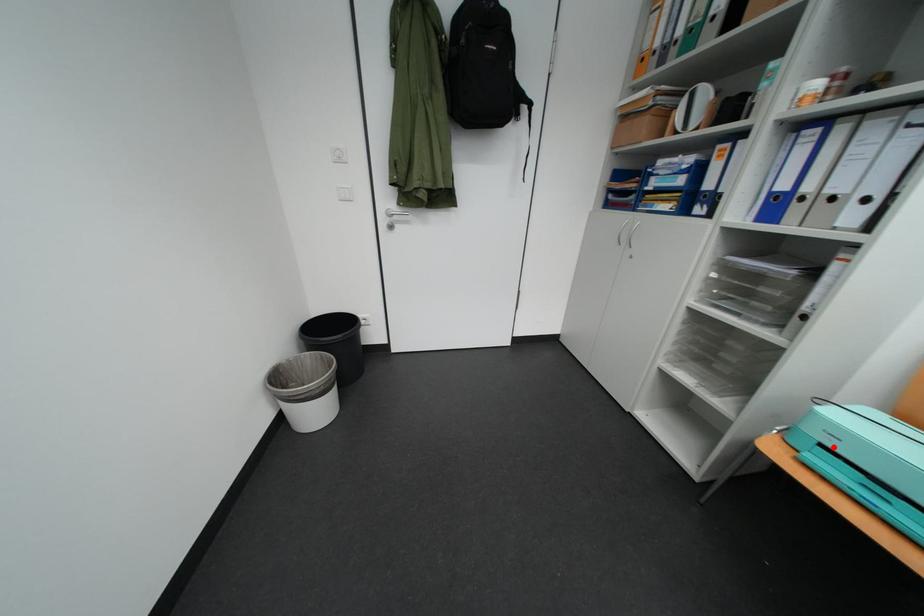
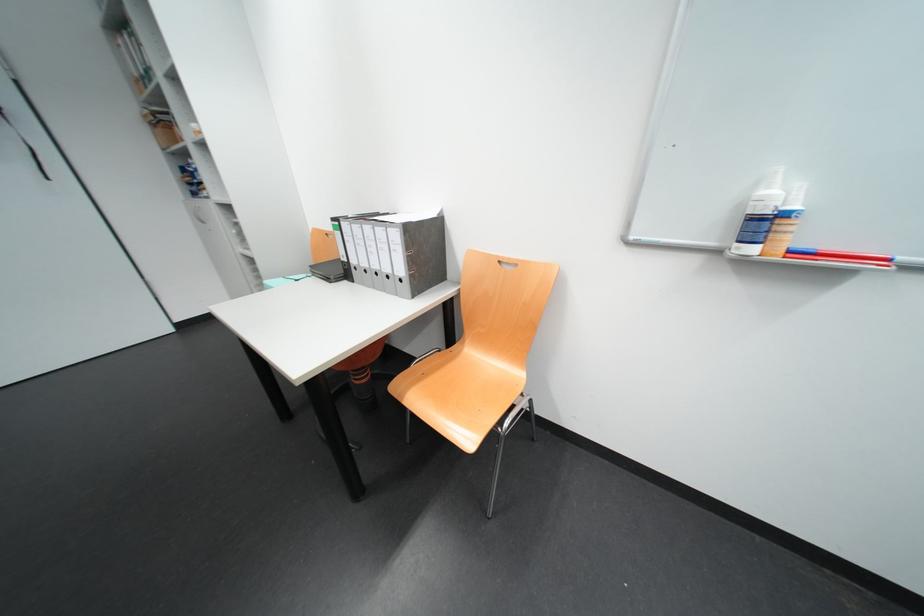
Question: I am providing you with two images of the same scene from different viewpoints. A red point is marked on the first image. At the location where the point appears in image 1, is it still visible in image 2?

Choices:
 (A) Yes
 (B) No

Answer: (B)